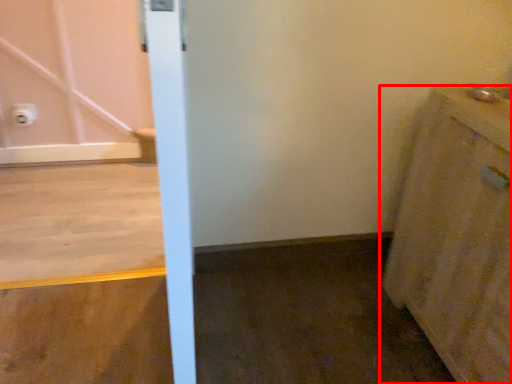
Question: From the image's perspective, where is cabinetry (annotated by the red box) located in relation to electric outlet in the image?

Choices:
 (A) above
 (B) below

Answer: (B)